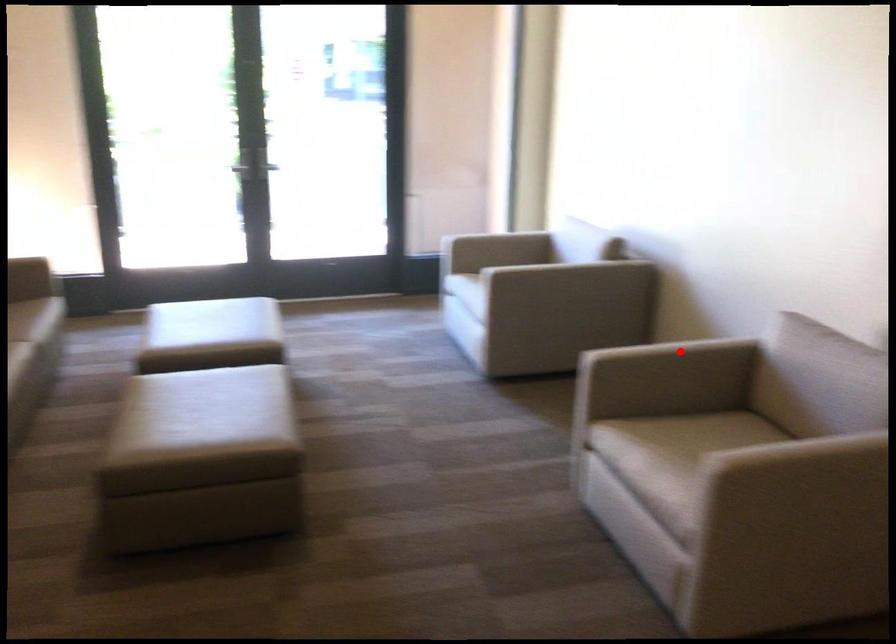
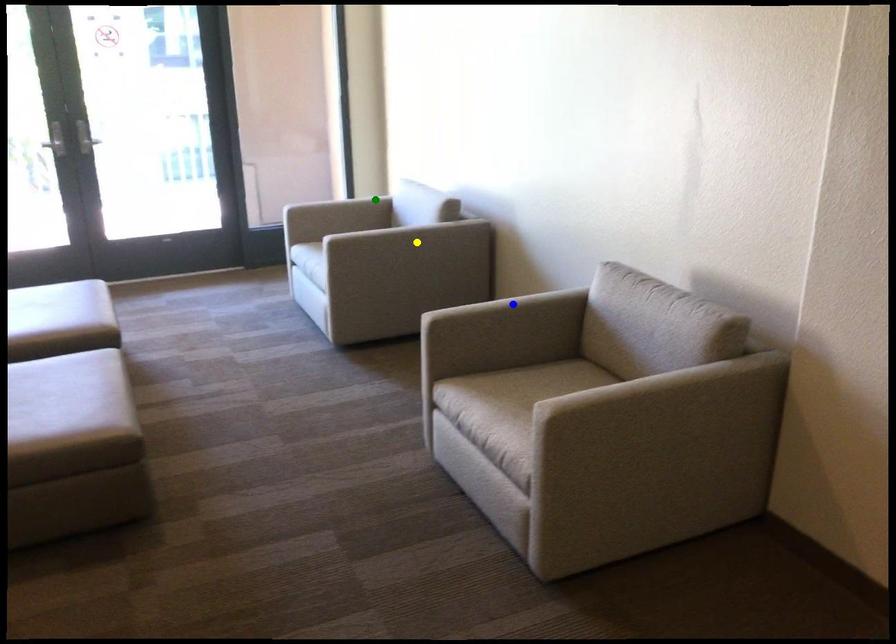
Question: I am providing you with two images of the same scene from different viewpoints. A red point is marked on the first image. You are given multiple points on the second image. Which mark in image 2 goes with the point in image 1?

Choices:
 (A) yellow point
 (B) blue point
 (C) green point

Answer: (B)